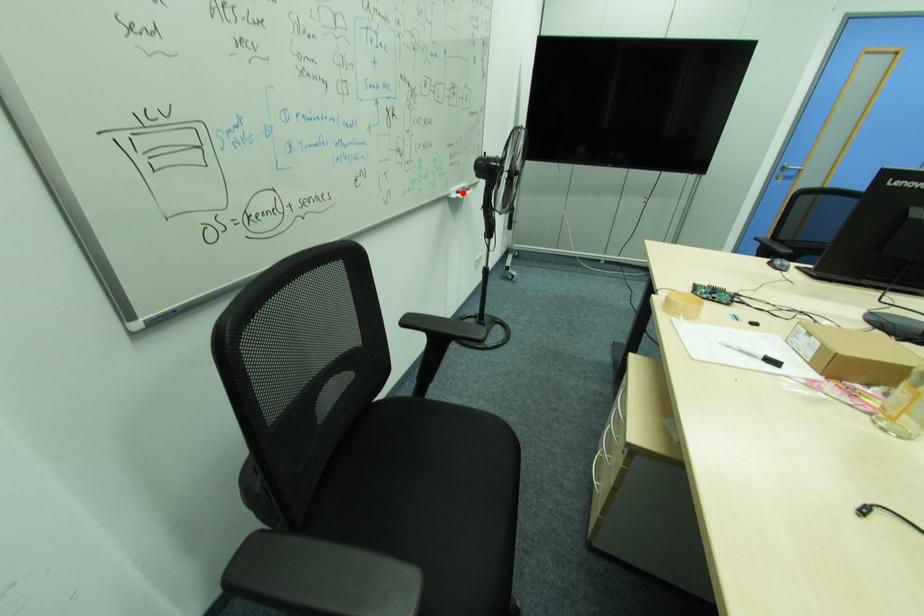
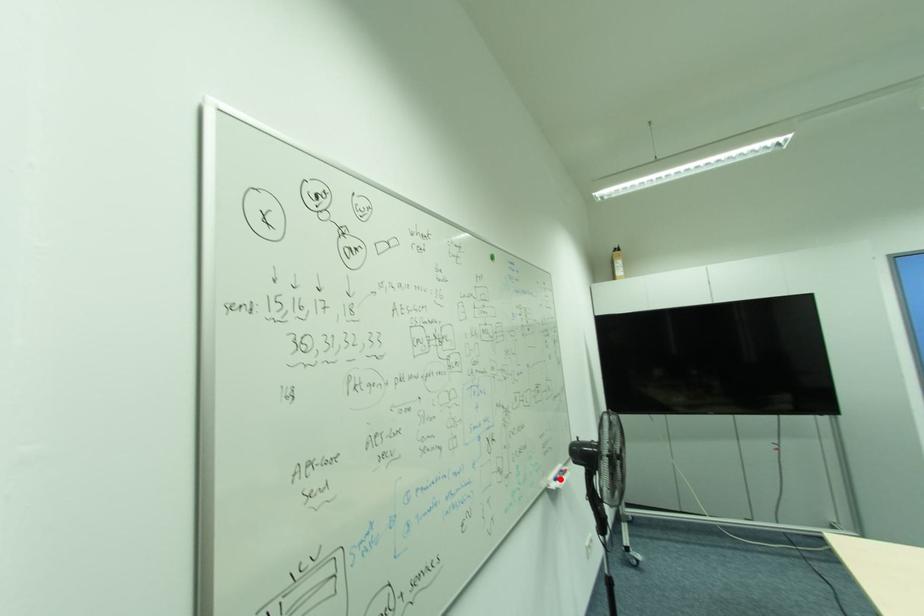
I am providing you with two images of the same scene from different viewpoints. A red point is marked on the first image and another point is marked on the second image. Do the highlighted points in image1 and image2 indicate the same real-world spot?

Yes